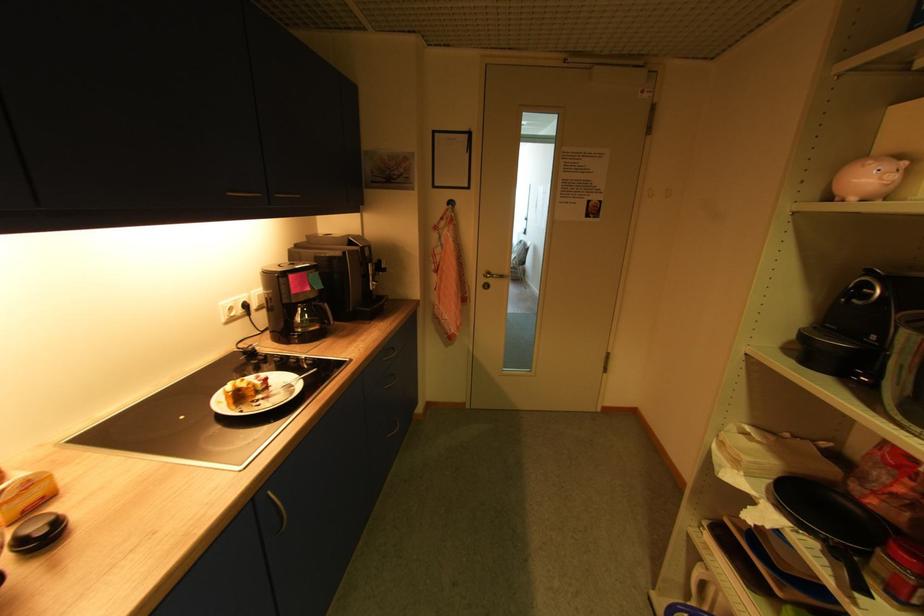
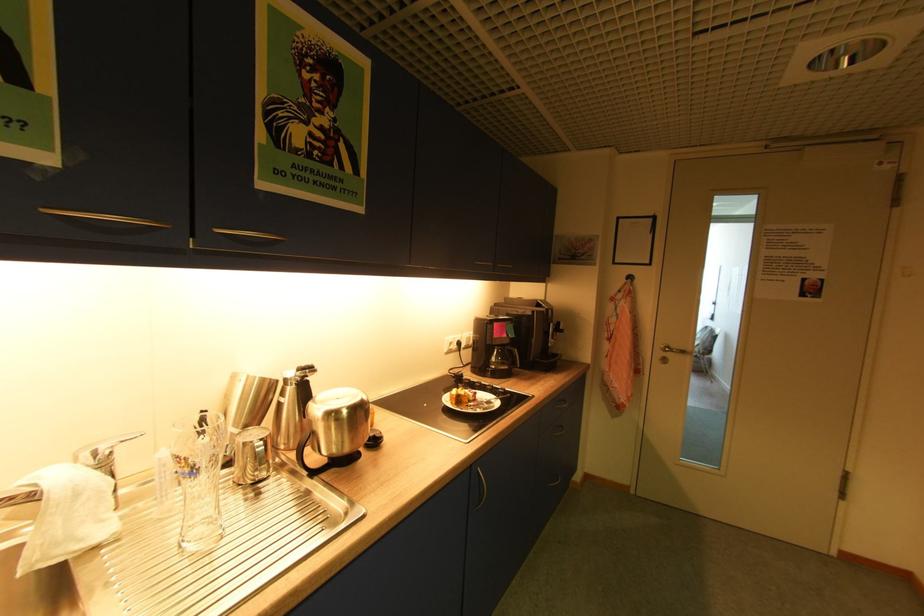
Question: Based on the continuous images, in which direction is the camera rotating? Reply with the corresponding letter.

Choices:
 (A) Left
 (B) Right
 (C) Up
 (D) Down

Answer: (A)